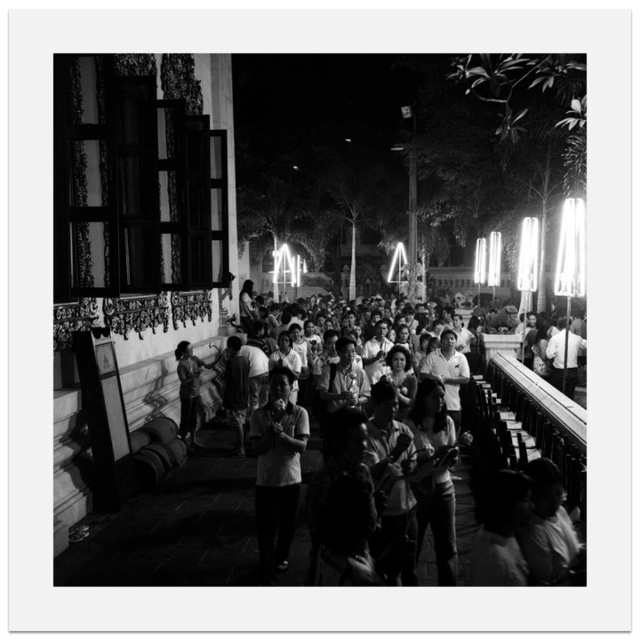
You are standing at the point marked at (269, 381). You want to walk to the nearest building entrance. Is the distance less than 10 meters?

The distance between you and the nearest building entrance is 8.32 meters, which is less than 10 meters. Yes, it is within the desired distance.